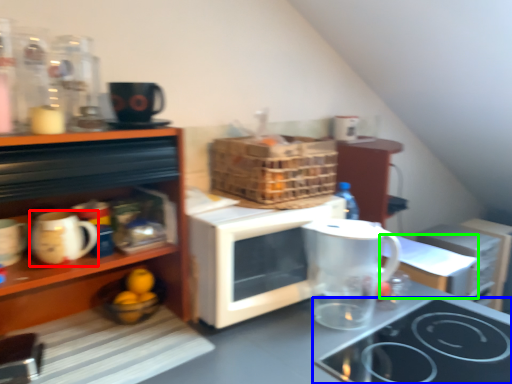
Question: Which object is the closest to the mug (highlighted by a red box)? Choose among these: gas stove (highlighted by a blue box) or table (highlighted by a green box).

Choices:
 (A) gas stove
 (B) table

Answer: (A)